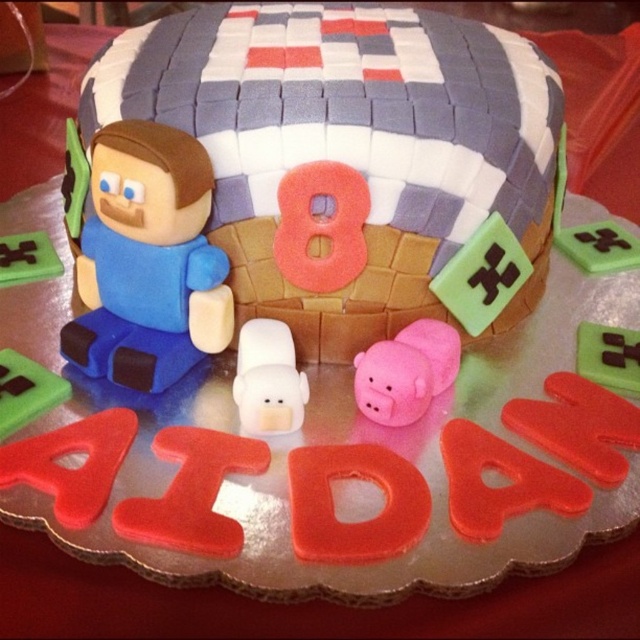
Is white matte pig at center taller than green matte square at lower left?

Indeed, white matte pig at center has a greater height compared to green matte square at lower left.

Is point (269, 332) closer to camera compared to point (33, 392)?

No, it is not.

The image size is (640, 640). I want to click on white matte pig at center, so click(x=268, y=380).

Can you confirm if pink matte pig at center is bigger than green matte square at lower left?

Yes.

Consider the image. Is pink matte pig at center taller than green matte square at lower left?

Indeed, pink matte pig at center has a greater height compared to green matte square at lower left.

Between point (396, 365) and point (8, 371), which one is positioned in front?

Positioned in front is point (396, 365).

In order to click on pink matte pig at center in this screenshot , I will do `click(404, 371)`.

Which is more to the left, matte fondant cake at center or white matte pig at center?

Positioned to the left is white matte pig at center.

You are a GUI agent. You are given a task and a screenshot of the screen. Output one action in this format:
    pyautogui.click(x=<x>, y=<y>)
    Task: Click on the matte fondant cake at center
    
    Given the screenshot: What is the action you would take?
    pyautogui.click(x=349, y=145)

Which is in front, point (403, 134) or point (273, 378)?

Point (273, 378) is more forward.

The height and width of the screenshot is (640, 640). In order to click on matte fondant cake at center in this screenshot , I will do click(x=349, y=145).